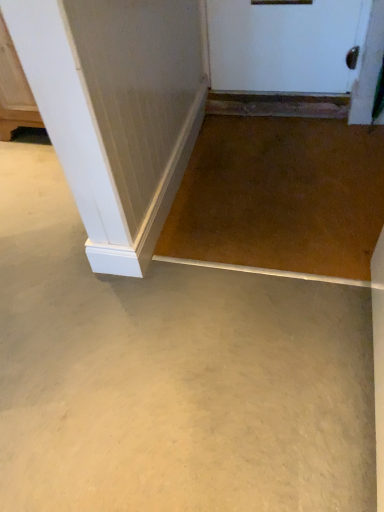
Question: From the image's perspective, is clear glass screen door at upper right over smooth concrete floor at center?

Choices:
 (A) no
 (B) yes

Answer: (B)

Question: Considering the relative sizes of clear glass screen door at upper right and smooth concrete floor at center in the image provided, is clear glass screen door at upper right thinner than smooth concrete floor at center?

Choices:
 (A) yes
 (B) no

Answer: (A)

Question: Is clear glass screen door at upper right to the left of smooth concrete floor at center from the viewer's perspective?

Choices:
 (A) no
 (B) yes

Answer: (A)

Question: Is clear glass screen door at upper right not within smooth concrete floor at center?

Choices:
 (A) no
 (B) yes

Answer: (B)

Question: From a real-world perspective, is clear glass screen door at upper right on top of smooth concrete floor at center?

Choices:
 (A) yes
 (B) no

Answer: (A)

Question: Are clear glass screen door at upper right and smooth concrete floor at center far apart?

Choices:
 (A) no
 (B) yes

Answer: (B)

Question: From the image's perspective, is smooth concrete floor at center below clear glass screen door at upper right?

Choices:
 (A) no
 (B) yes

Answer: (B)

Question: Is smooth concrete floor at center turned away from clear glass screen door at upper right?

Choices:
 (A) no
 (B) yes

Answer: (A)

Question: Considering the relative sizes of smooth concrete floor at center and clear glass screen door at upper right in the image provided, is smooth concrete floor at center taller than clear glass screen door at upper right?

Choices:
 (A) no
 (B) yes

Answer: (A)

Question: From the image's perspective, is smooth concrete floor at center above clear glass screen door at upper right?

Choices:
 (A) no
 (B) yes

Answer: (A)

Question: Can you confirm if smooth concrete floor at center is positioned to the left of clear glass screen door at upper right?

Choices:
 (A) no
 (B) yes

Answer: (B)

Question: Is smooth concrete floor at center not inside clear glass screen door at upper right?

Choices:
 (A) no
 (B) yes

Answer: (B)

Question: From their relative heights in the image, would you say smooth concrete floor at center is taller or shorter than clear glass screen door at upper right?

Choices:
 (A) short
 (B) tall

Answer: (A)